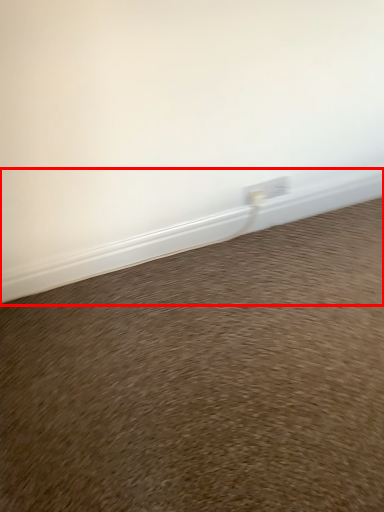
Question: From the image, what is the correct spatial relationship of window sill (annotated by the red box) in relation to sand?

Choices:
 (A) left
 (B) right

Answer: (A)